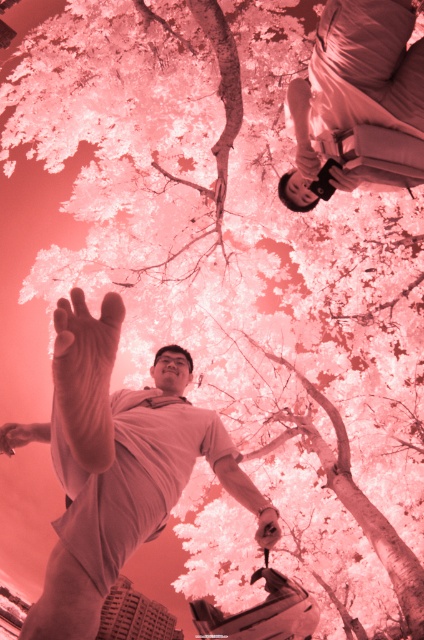
Question: Among these objects, which one is farthest from the camera?

Choices:
 (A) white cotton shirt at center
 (B) matte black camera at upper center

Answer: (B)

Question: Can you confirm if white cotton shirt at center is smaller than matte black camera at upper center?

Choices:
 (A) no
 (B) yes

Answer: (A)

Question: Which of the following is the farthest from the observer?

Choices:
 (A) white cotton shirt at center
 (B) matte black camera at upper center

Answer: (B)

Question: Is white cotton shirt at center positioned behind matte black camera at upper center?

Choices:
 (A) no
 (B) yes

Answer: (A)

Question: Is white cotton shirt at center below matte black camera at upper center?

Choices:
 (A) yes
 (B) no

Answer: (A)